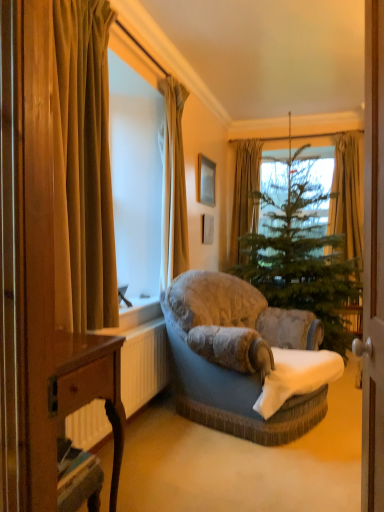
Image resolution: width=384 pixels, height=512 pixels. Identify the location of vacant area in front of velvet grey couch at center. (236, 474).